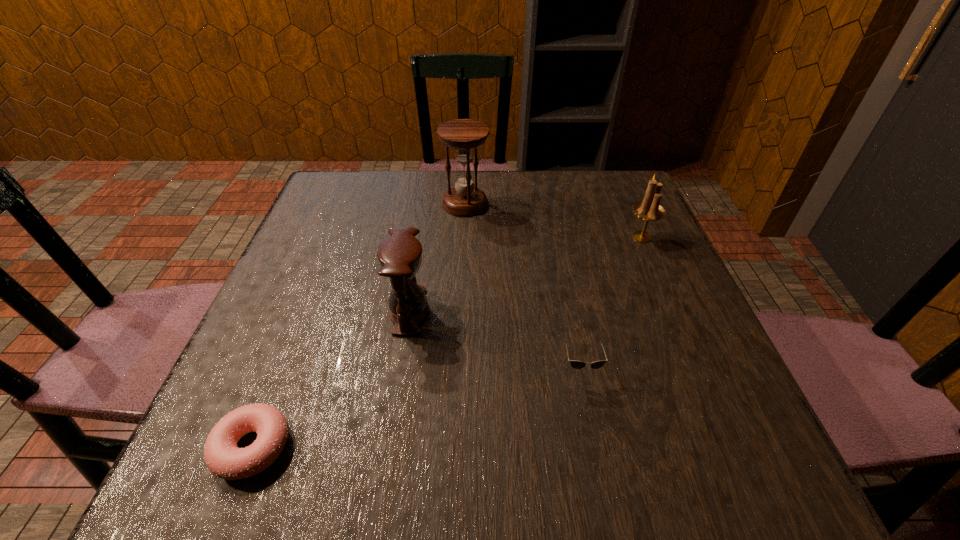
I want to click on the farthest object, so click(x=463, y=135).

Locate an element on the screen. the taller hourglass is located at coordinates (463, 135).

Find the location of a particular element. the second farthest object is located at coordinates (650, 210).

Find the location of a particular element. the rightmost object is located at coordinates (650, 210).

Image resolution: width=960 pixels, height=540 pixels. Identify the location of the third nearest object. (400, 256).

This screenshot has width=960, height=540. I want to click on the shorter hourglass, so click(x=400, y=256).

Locate an element on the screen. This screenshot has width=960, height=540. the fourth object from left to right is located at coordinates (576, 364).

Locate an element on the screen. the fourth farthest object is located at coordinates (576, 364).

Locate an element on the screen. The height and width of the screenshot is (540, 960). the leftmost object is located at coordinates (225, 460).

The width and height of the screenshot is (960, 540). I want to click on doughnut, so click(225, 460).